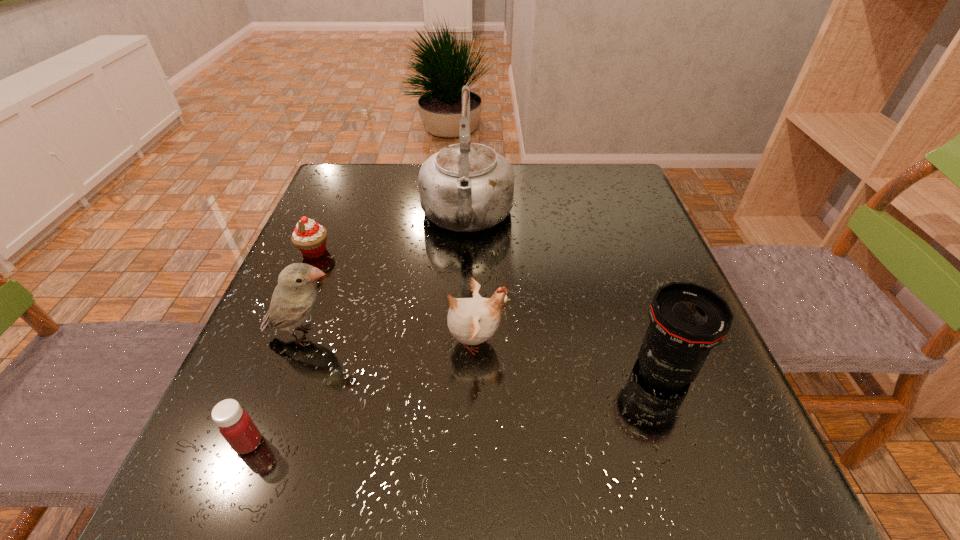
Locate an element on the screen. The height and width of the screenshot is (540, 960). the tallest object is located at coordinates (466, 187).

Find the location of `the left bird`. the left bird is located at coordinates (294, 298).

At what (x,y) coordinates should I click in order to perform the action: click on telephoto lens. Please return your answer as a coordinate pair (x, y). This screenshot has height=540, width=960. Looking at the image, I should click on (686, 320).

I want to click on the shorter bird, so click(471, 321).

Where is `cupcake`? cupcake is located at coordinates [x=309, y=237].

You are a GUI agent. You are given a task and a screenshot of the screen. Output one action in this format:
    pyautogui.click(x=<x>, y=<y>)
    Task: Click on the nearest object
    
    Given the screenshot: What is the action you would take?
    pyautogui.click(x=235, y=425)

You are a GUI agent. You are given a task and a screenshot of the screen. Output one action in this format:
    pyautogui.click(x=<x>, y=<y>)
    Task: Click on the free space located at the spout of the kettle
    The width and height of the screenshot is (960, 540).
    Given the screenshot: What is the action you would take?
    pyautogui.click(x=463, y=343)

At what (x,y) coordinates should I click in order to perform the action: click on blank area located 0.280m at the face of the taller bird. Please return your answer as a coordinate pair (x, y). This screenshot has width=960, height=540. Looking at the image, I should click on (490, 335).

The image size is (960, 540). Find the location of `free region located on the back of the rightmost object`. free region located on the back of the rightmost object is located at coordinates (643, 313).

Identify the location of free space located 0.310m at the beak of the shorter bird. Image resolution: width=960 pixels, height=540 pixels. (671, 341).